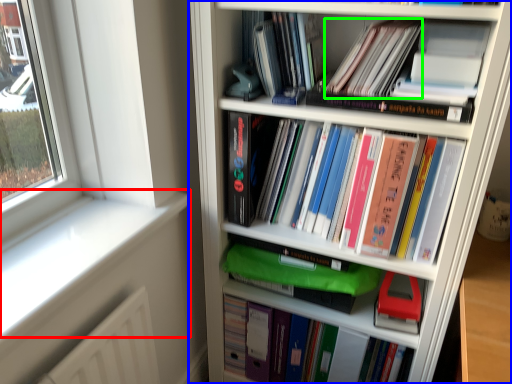
Question: Which object is positioned closest to window sill (highlighted by a red box)? Select from bookcase (highlighted by a blue box) and book (highlighted by a green box).

Choices:
 (A) bookcase
 (B) book

Answer: (A)